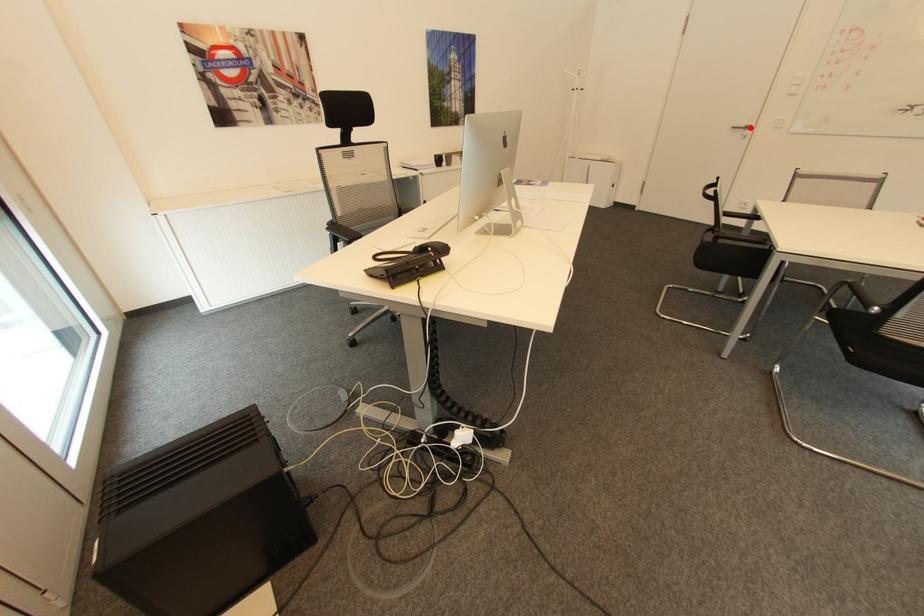
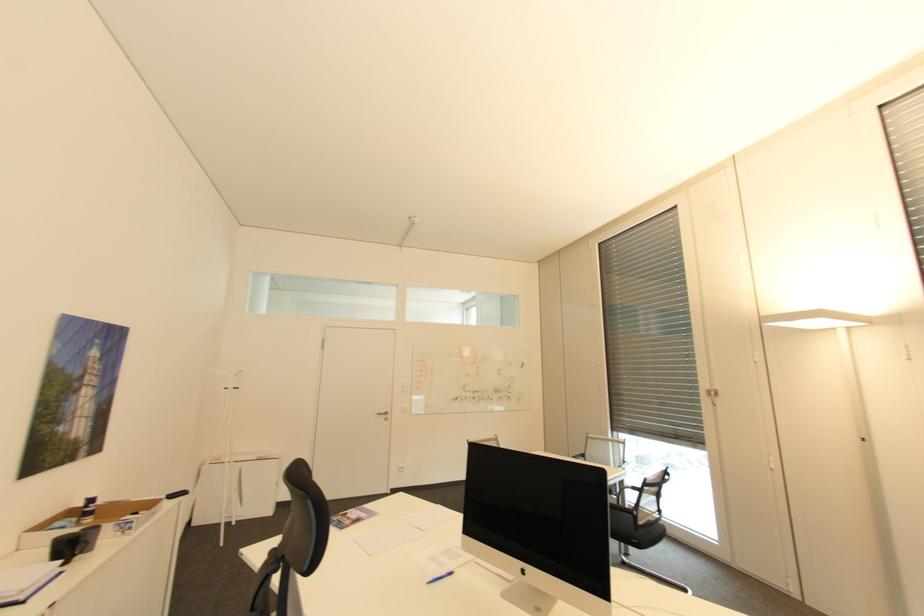
In the second image, find the point that corresponds to the highlighted location in the first image.

(391, 413)